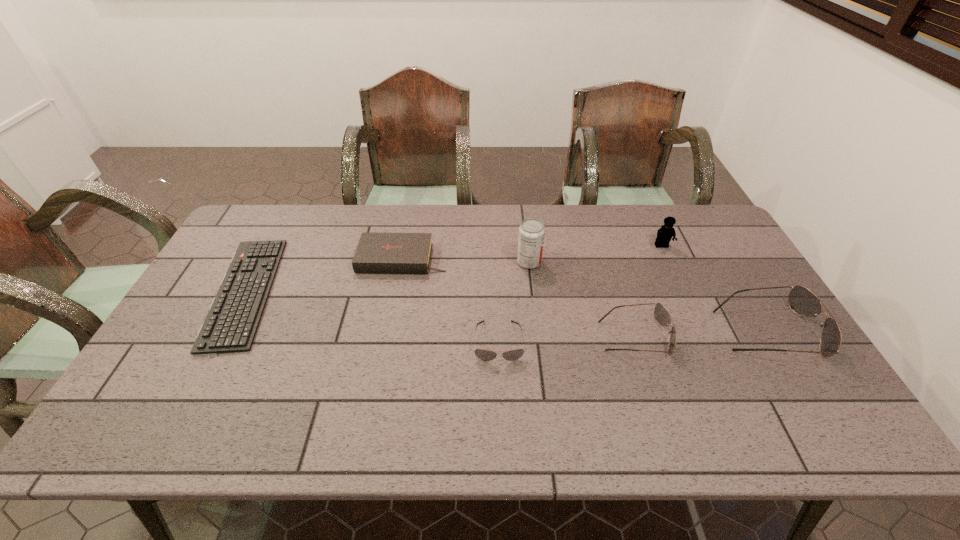
The height and width of the screenshot is (540, 960). Identify the location of the fifth object from right to left. (486, 355).

The height and width of the screenshot is (540, 960). In order to click on the shortest sunglasses in this screenshot , I will do `click(486, 355)`.

Locate an element on the screen. This screenshot has height=540, width=960. the second tallest sunglasses is located at coordinates 662,316.

Identify the location of the fifth object from left to right. This screenshot has height=540, width=960. (662, 316).

The height and width of the screenshot is (540, 960). In order to click on the tallest sunglasses in this screenshot , I will do `click(803, 302)`.

Find the location of a particular element. the rightmost sunglasses is located at coordinates (803, 302).

At what (x,y) coordinates should I click in order to perform the action: click on the leftmost object. Please return your answer as a coordinate pair (x, y). Looking at the image, I should click on (231, 324).

Where is `computer keyboard`? The image size is (960, 540). computer keyboard is located at coordinates (231, 324).

Where is `the fourth object from right to left`? This screenshot has width=960, height=540. the fourth object from right to left is located at coordinates [531, 231].

Where is `soda`? This screenshot has width=960, height=540. soda is located at coordinates (531, 231).